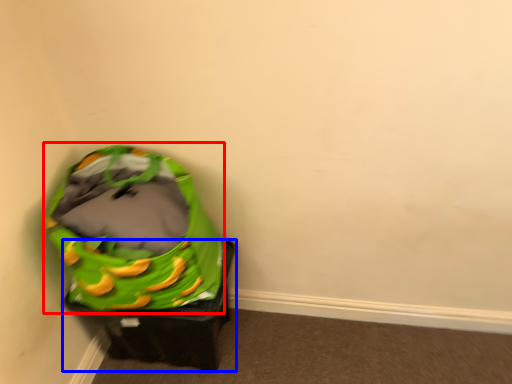
Question: Which object appears farthest to the camera in this image, bean bag chair (highlighted by a red box) or furniture (highlighted by a blue box)?

Choices:
 (A) bean bag chair
 (B) furniture

Answer: (B)